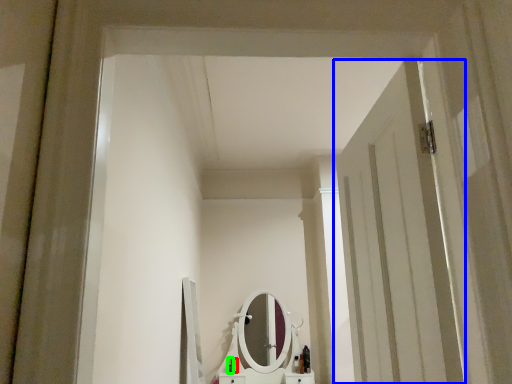
Question: Considering the real-world distances, which object is farthest from toiletry (highlighted by a red box)? door (highlighted by a blue box) or toiletry (highlighted by a green box)?

Choices:
 (A) door
 (B) toiletry

Answer: (A)